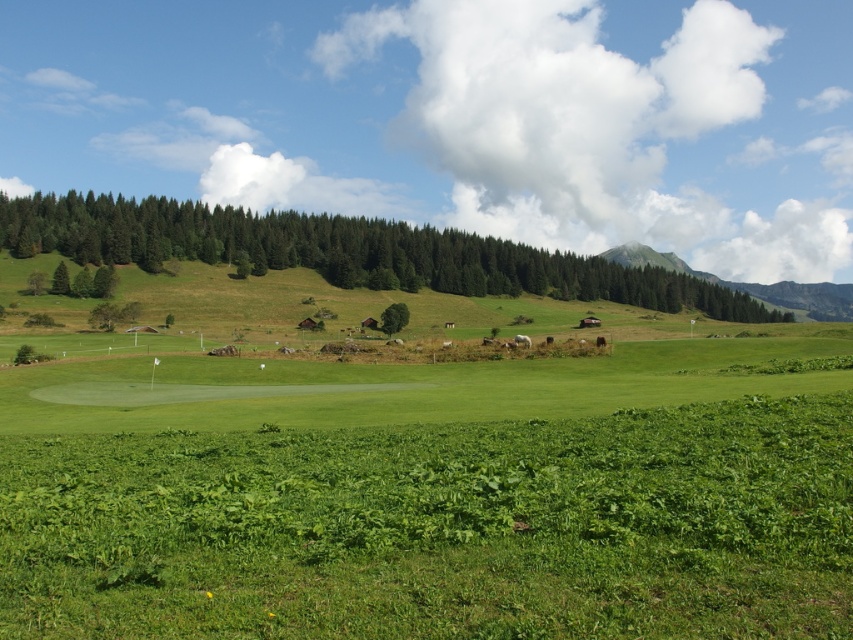
Question: Is green matte trees at upper left smaller than green leafy tree at center?

Choices:
 (A) yes
 (B) no

Answer: (B)

Question: Which of the following is the farthest from the observer?

Choices:
 (A) green leafy tree at center
 (B) green grassy mountain at upper center

Answer: (B)

Question: Which object is positioned farthest from the green leafy tree at center?

Choices:
 (A) green matte trees at upper left
 (B) green grassy mountain at upper center

Answer: (B)

Question: Is green matte trees at upper left thinner than green grassy mountain at upper center?

Choices:
 (A) yes
 (B) no

Answer: (B)

Question: Considering the real-world distances, which object is farthest from the green matte trees at upper left?

Choices:
 (A) green leafy tree at center
 (B) green grassy mountain at upper center

Answer: (B)

Question: From the image, what is the correct spatial relationship of green matte trees at upper left in relation to green grassy mountain at upper center?

Choices:
 (A) right
 (B) left

Answer: (B)